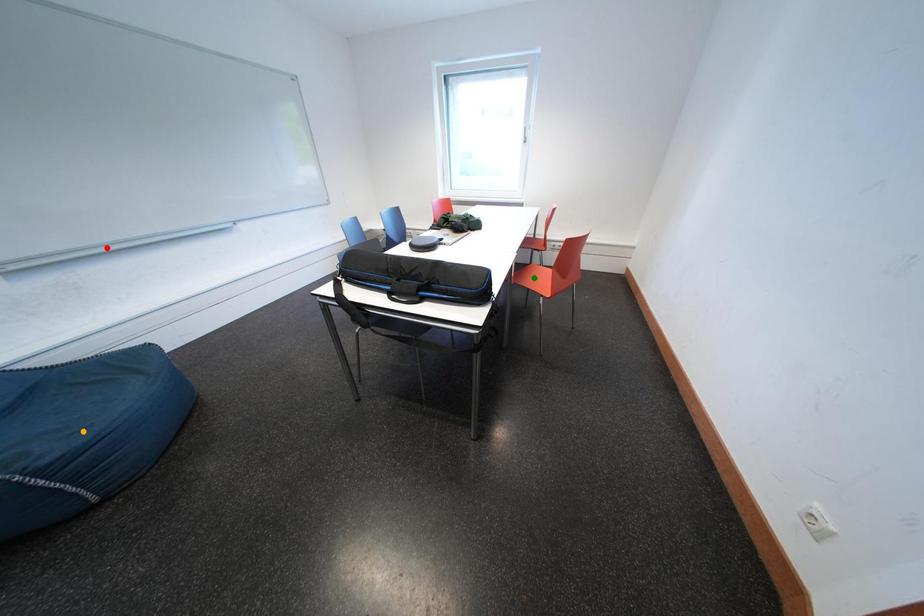
In the scene shown: Order these from nearest to farthest:
red point
orange point
green point

orange point → green point → red point